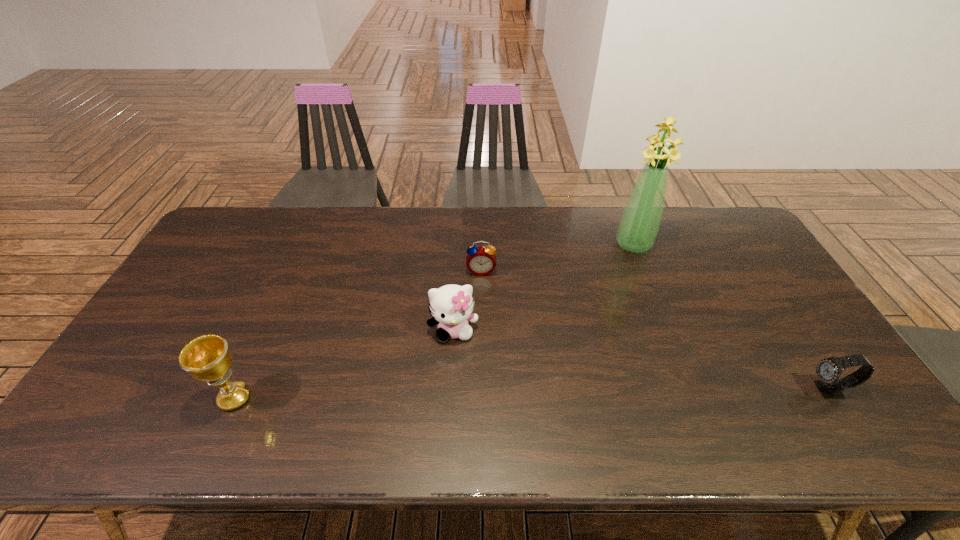
Identify the location of free spot on the desktop that is between the chalice and the rightmost object and is positioned on the front-facing side of the kitten. (463, 395).

Locate an element on the screen. This screenshot has width=960, height=540. free spot on the desktop that is between the leftmost object and the rightmost object and is positioned on the front-facing side of the alarm clock is located at coordinates (479, 395).

Locate an element on the screen. This screenshot has width=960, height=540. vacant space on the desktop that is between the leftmost object and the watch and is positioned on the front-facing side of the second object from right to left is located at coordinates (567, 394).